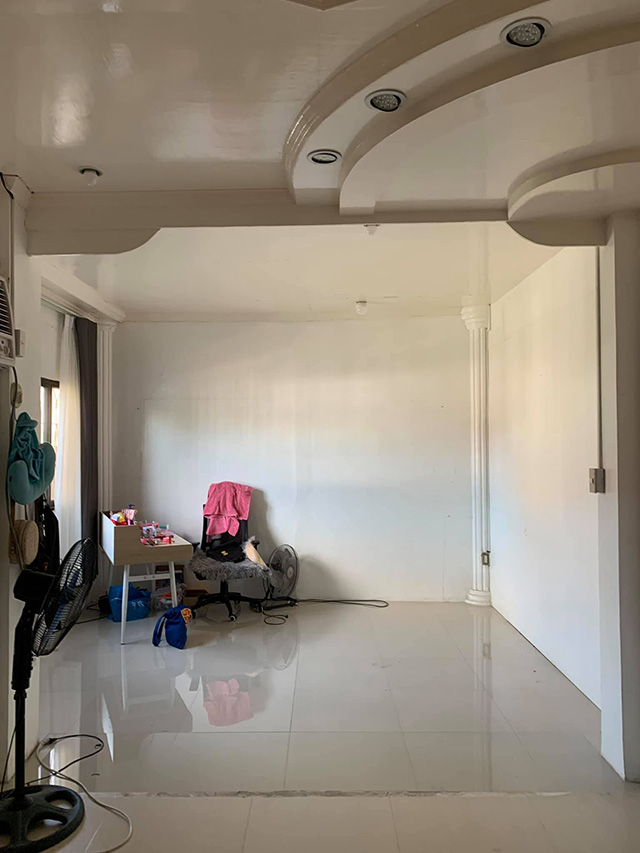
You are a GUI agent. You are given a task and a screenshot of the screen. Output one action in this format:
    pyautogui.click(x=<x>, y=<y>)
    Task: Click on the fans
    
    Given the screenshot: What is the action you would take?
    pyautogui.click(x=278, y=573), pyautogui.click(x=77, y=589)